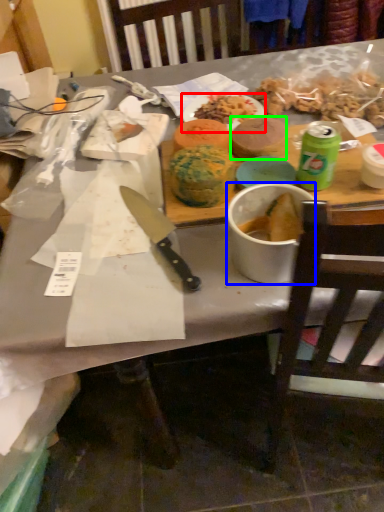
Question: Considering the real-world distances, which object is farthest from plate (highlighted by a red box)? bowl (highlighted by a blue box) or food (highlighted by a green box)?

Choices:
 (A) bowl
 (B) food

Answer: (A)